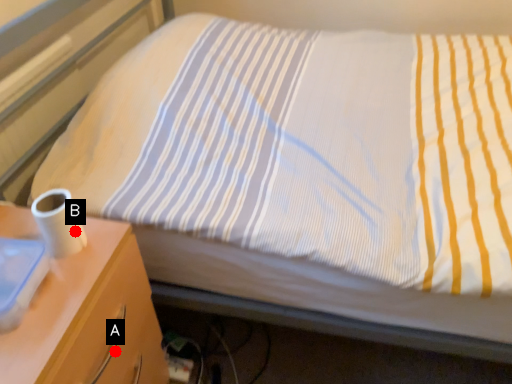
Question: Two points are circled on the image, labeled by A and B beside each circle. Which point is farther to the camera?

Choices:
 (A) A is further
 (B) B is further

Answer: (A)